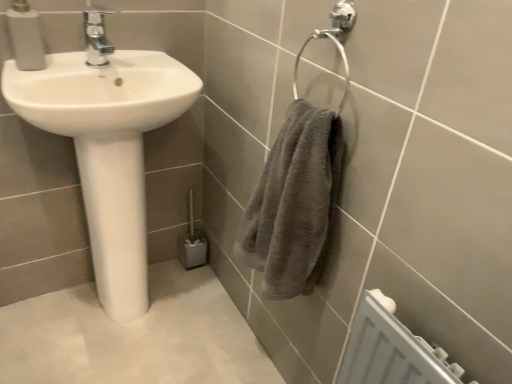
Question: Is gray fluffy towel at right in front of or behind chrome metallic faucet at upper center in the image?

Choices:
 (A) front
 (B) behind

Answer: (A)

Question: Is gray fluffy towel at right wider or thinner than chrome metallic faucet at upper center?

Choices:
 (A) wide
 (B) thin

Answer: (A)

Question: Which is farther from the matte white soap dispenser at upper left?

Choices:
 (A) gray fluffy towel at right
 (B) white glossy sink at left
 (C) chrome metallic faucet at upper center

Answer: (A)

Question: Estimate the real-world distances between objects in this image. Which object is closer to the matte white soap dispenser at upper left?

Choices:
 (A) white glossy sink at left
 (B) chrome metallic faucet at upper center
 (C) gray fluffy towel at right

Answer: (B)